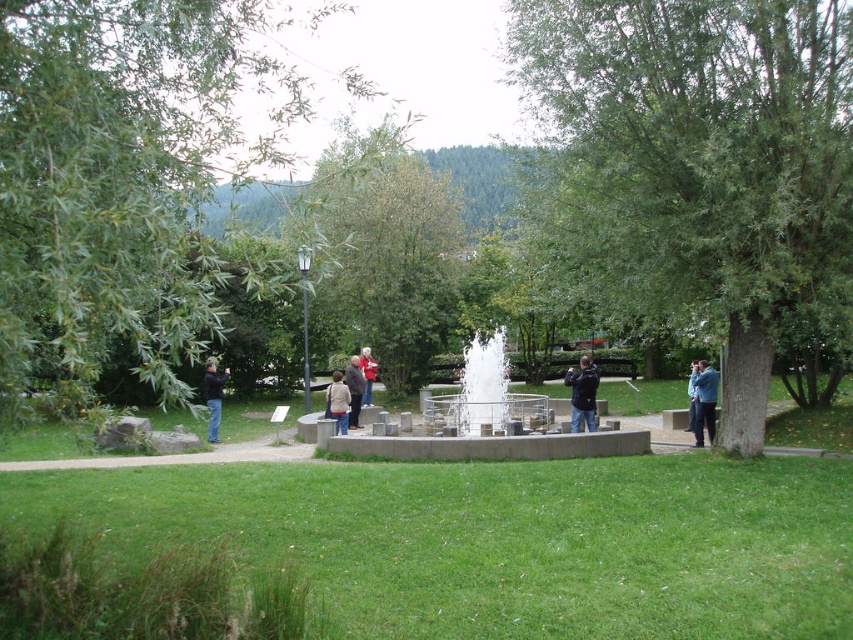
You are standing on the paved pathway in the park and see the blue denim jacket at right and the dark blue jeans at left. Which object is positioned more to the east if the sun is setting in the west?

The dark blue jeans at left are positioned more to the east because the blue denim jacket at right is to the right of dark blue jeans at left, and since the sun is setting in the west, the right side of the image would face west while the left side faces east.

You are a photographer trying to capture the fountain in the center of the park. You notice a green leafy tree at left and dark blue jeans at left in your current view. Which object should you avoid blocking the fountain with?

The green leafy tree at left is much taller than the dark blue jeans at left, so you should avoid blocking the fountain with the green leafy tree at left as it is taller and more likely to obstruct the view.

Looking at this image, you are standing on the paved pathway and want to take a photo of both the green leafy tree at left and the dark blue jeans at left. Which object should you focus on first to ensure both are in sharp focus?

You should focus on the green leafy tree at left first because it is closer to you than the dark blue jeans at left, so adjusting focus from near to far will help both be in focus.